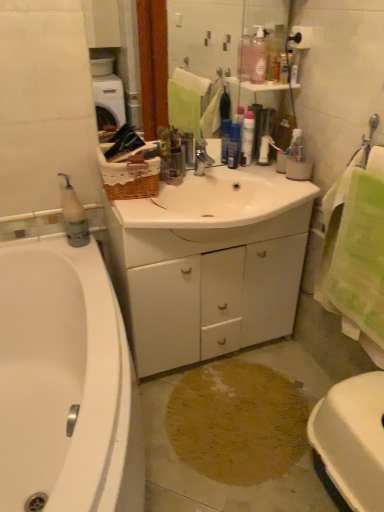
Locate an element on the screen. The image size is (384, 512). free space above brown textured rug at center (from a real-world perspective) is located at coordinates (221, 411).